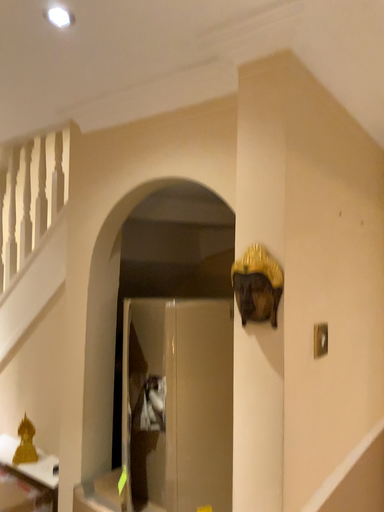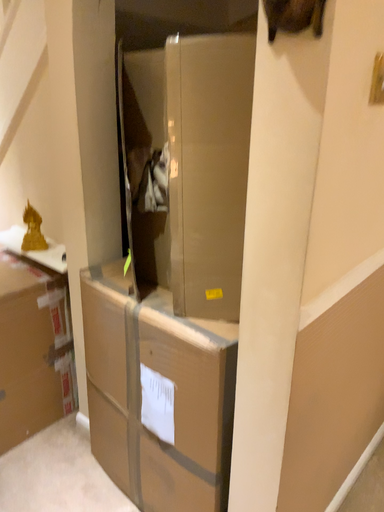
Question: How did the camera likely rotate when shooting the video?

Choices:
 (A) rotated upward
 (B) rotated downward

Answer: (B)